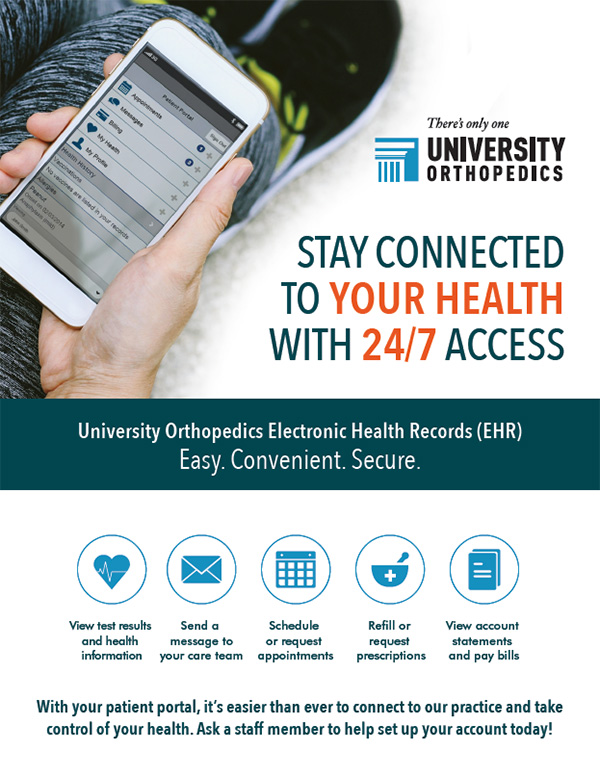
What are the coordinates of `files` in the screenshot? It's located at pos(471,579).